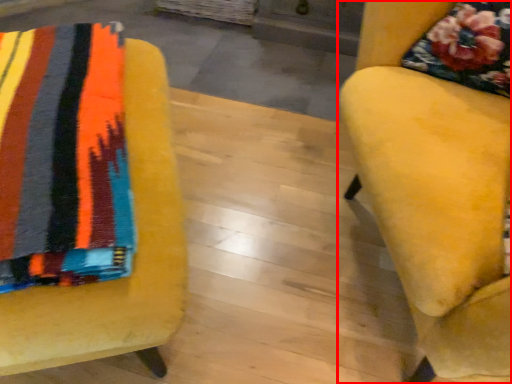
Question: From the image's perspective, what is the correct spatial positioning of chair (annotated by the red box) in reference to chair?

Choices:
 (A) above
 (B) below

Answer: (A)